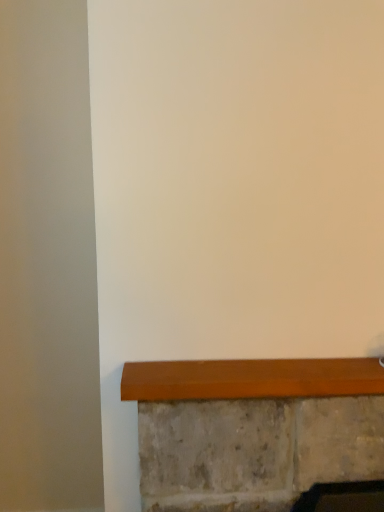
This screenshot has width=384, height=512. What do you see at coordinates (250, 379) in the screenshot? I see `matte wood window sill at lower center` at bounding box center [250, 379].

At what (x,y) coordinates should I click in order to perform the action: click on matte wood window sill at lower center. Please return your answer as a coordinate pair (x, y). The height and width of the screenshot is (512, 384). Looking at the image, I should click on (250, 379).

Where is `matte wood window sill at lower center`? The height and width of the screenshot is (512, 384). matte wood window sill at lower center is located at coordinates (250, 379).